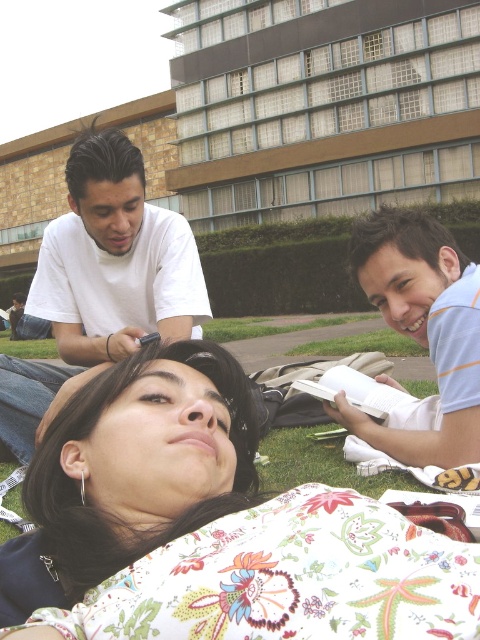
You are a photographer setting up a shot of the scene. You need to place a small tripod between the floral fabric pillow at lower center and the light blue striped shirt at lower right. Can you fit it there if the tripod requires 1 meter of space between the two objects?

The floral fabric pillow at lower center might be wider than light blue striped shirt at lower right, so the distance between them is uncertain. Without knowing the exact distance, it is not possible to confirm if the tripod will fit.

You are a photographer standing at the center of the park. You want to take a photo of the white matte shirt at upper left and the floral fabric pillow at lower center. The minimum distance required for your camera lens to focus on both objects clearly is 5 feet. Will your camera be able to focus on both objects simultaneously?

The white matte shirt at upper left is 4.43 feet away from the floral fabric pillow at lower center. Since the distance between them is less than the 5 feet minimum required by the camera lens, the camera can focus on both objects simultaneously.